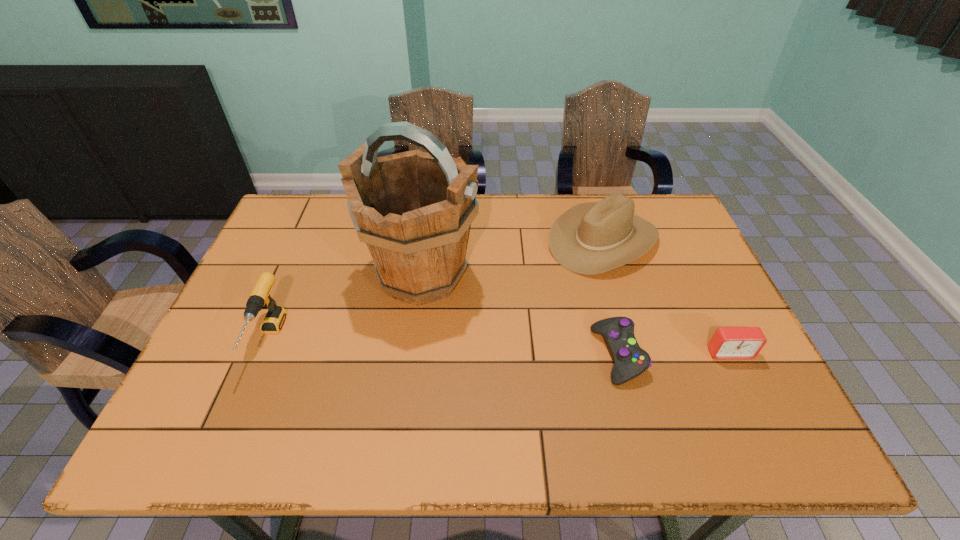
Find the location of a particular element. vacant space at the right edge is located at coordinates (x=718, y=327).

You are a GUI agent. You are given a task and a screenshot of the screen. Output one action in this format:
    pyautogui.click(x=<x>, y=<y>)
    Task: Click on the vacant space at the far left corner of the desktop
    The width and height of the screenshot is (960, 540).
    Given the screenshot: What is the action you would take?
    pyautogui.click(x=297, y=220)

The height and width of the screenshot is (540, 960). Find the location of `vacant space at the near left corner of the desktop`. vacant space at the near left corner of the desktop is located at coordinates (196, 447).

You are a GUI agent. You are given a task and a screenshot of the screen. Output one action in this format:
    pyautogui.click(x=<x>, y=<y>)
    Task: Click on the unoccupied area between the alarm clock and the drill
    Image resolution: width=960 pixels, height=540 pixels.
    Given the screenshot: What is the action you would take?
    pyautogui.click(x=499, y=346)

Locate an element on the screen. The height and width of the screenshot is (540, 960). empty space between the cowboy hat and the alarm clock is located at coordinates (665, 296).

The width and height of the screenshot is (960, 540). I want to click on vacant point located between the cowboy hat and the alarm clock, so click(x=665, y=296).

Locate an element on the screen. Image resolution: width=960 pixels, height=540 pixels. vacant area that lies between the second shortest object and the control is located at coordinates (674, 354).

You are a GUI agent. You are given a task and a screenshot of the screen. Output one action in this format:
    pyautogui.click(x=<x>, y=<y>)
    Task: Click on the free space between the control and the second shortest object
    The width and height of the screenshot is (960, 540).
    Given the screenshot: What is the action you would take?
    pyautogui.click(x=674, y=354)

This screenshot has height=540, width=960. Identify the location of free point between the bucket and the drill. (346, 307).

Where is `vacant space that's between the drill and the tallest object`? vacant space that's between the drill and the tallest object is located at coordinates (346, 307).